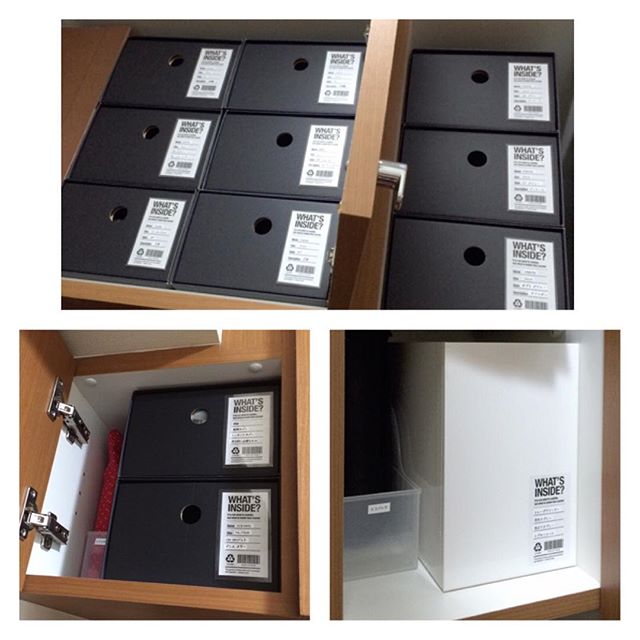
The width and height of the screenshot is (640, 640). In order to click on paper tray in this screenshot , I will do `click(377, 521)`.